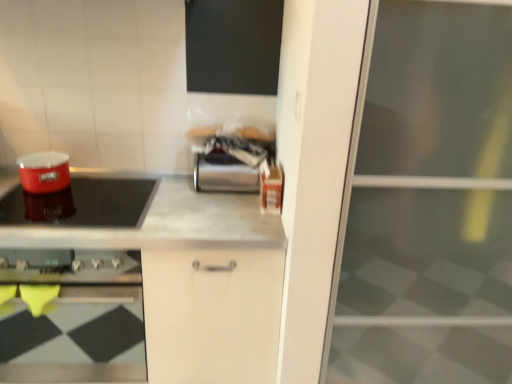
Question: Is shiny red pot at left taller or shorter than matte black cooktop at left?

Choices:
 (A) short
 (B) tall

Answer: (A)

Question: Visually, is shiny red pot at left positioned to the left or to the right of matte black cooktop at left?

Choices:
 (A) left
 (B) right

Answer: (B)

Question: Considering the real-world distances, which object is farthest from the satin silver canister at center, which ranks as the 2th appliance in left-to-right order?

Choices:
 (A) matte red pot at left, which ranks as the first appliance in left-to-right order
 (B) shiny red pot at left
 (C) transparent glass screen door at right
 (D) matte black cooktop at left
 (E) metallic gray countertop at center

Answer: (D)

Question: Which object is the farthest from the matte black cooktop at left?

Choices:
 (A) satin silver canister at center, which is the 1th appliance from right to left
 (B) matte red pot at left, which ranks as the first appliance in left-to-right order
 (C) transparent glass screen door at right
 (D) metallic gray countertop at center
 (E) shiny red pot at left

Answer: (C)